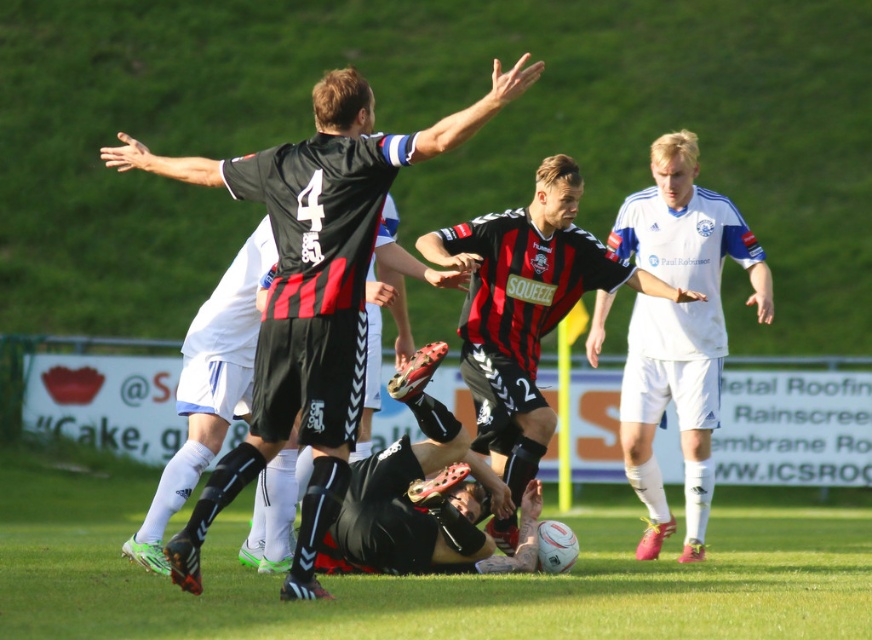
You are a soccer coach analyzing the game from the sidelines. You notice the white smooth soccer player at right is positioned 15.38 meters away from the camera. Considering the field layout, can you estimate how far this player is from the center circle?

The white smooth soccer player at right is 15.38 meters from the camera. Since the center circle has a radius of 9.15 meters, the player is positioned beyond the center circle.

You are a referee observing the soccer match. You notice the white smooth soccer player at right and the black jersey at center. Based on their positions, can you determine which player is closer to the ball?

The white smooth soccer player at right is above the black jersey at center, so the black jersey at center is closer to the ball.

What is the exact coordinate position of the black matte jersey at center?

The black matte jersey at center is located at point (312, 291).